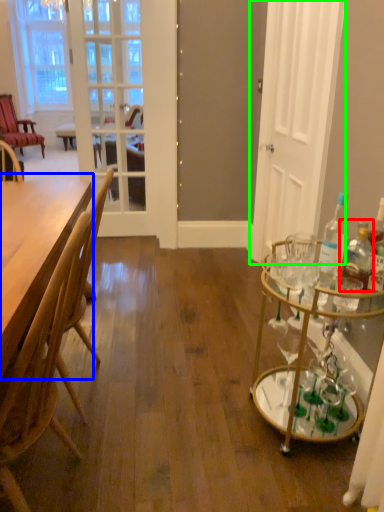
Question: Which is nearer to the bottle (highlighted by a red box)? table (highlighted by a blue box) or door (highlighted by a green box).

Choices:
 (A) table
 (B) door

Answer: (A)